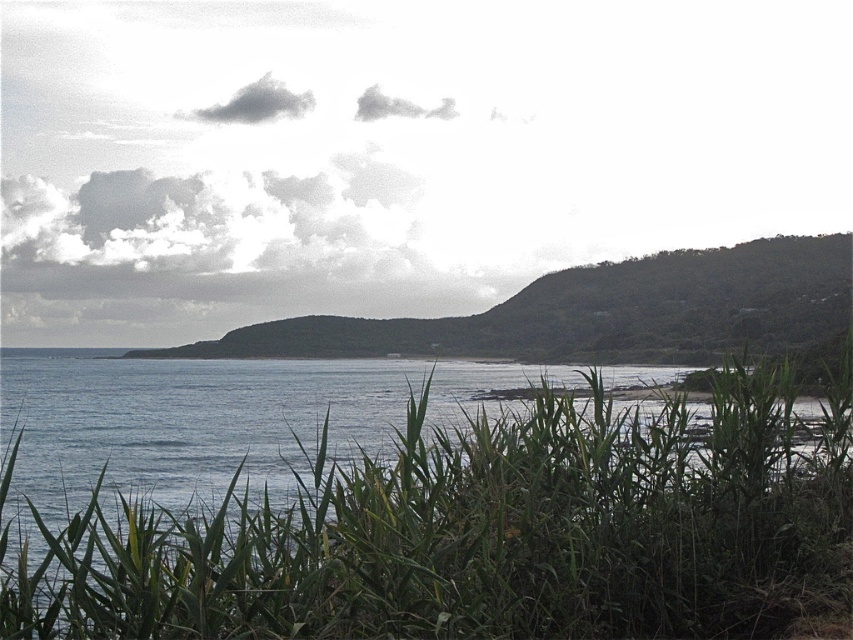
Who is more forward, (x=428, y=493) or (x=753, y=250)?

Point (x=428, y=493) is in front.

Find the location of a particular element. This screenshot has height=640, width=853. green leafy grass at lower center is located at coordinates coord(486,534).